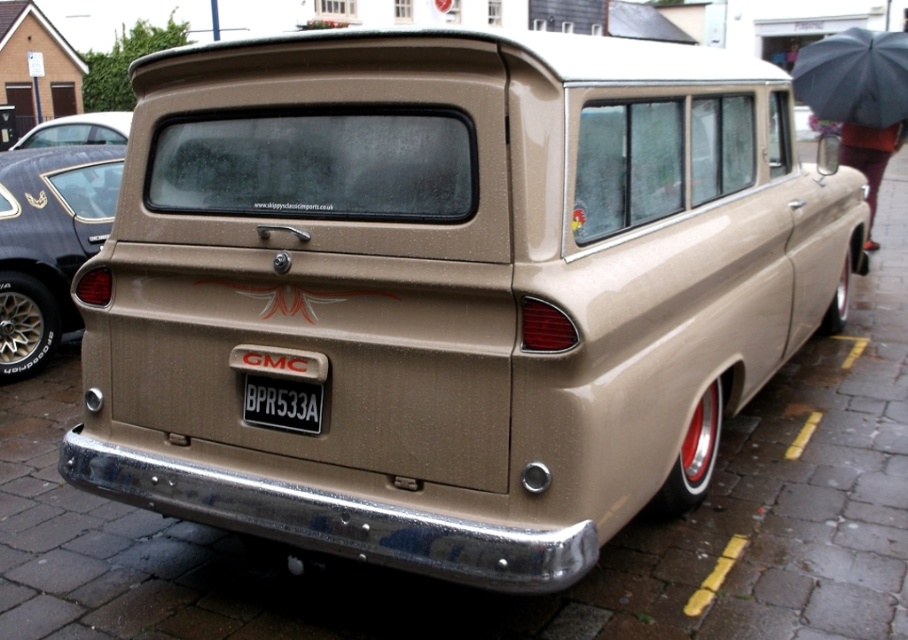
You are a delivery person trying to park your truck between the two vehicles in the image. The truck requires a minimum height clearance of 2 meters. Given that the matte gold van at center is shorter than the matte black car at upper left, which vehicle should you position your truck behind to ensure sufficient clearance?

The matte gold van at center has a lesser height compared to the matte black car at upper left. Therefore, positioning the truck behind the matte gold van at center would provide the required 2 meters of height clearance since it is shorter than the matte black car at upper left.

You are standing on the wet cobblestone street and see the matte gold van at center and the matte black car at upper left. Which vehicle is positioned lower in the scene?

The matte gold van at center is positioned lower than the matte black car at upper left.

You are a delivery person who needs to place the black matte umbrella at upper right and the black plastic license plate at center into a storage box. The box can only hold items narrower than 30 cm. Based on the scene, can both items fit in the box?

The black matte umbrella at upper right might be wider than black plastic license plate at center. Since the box can only hold items narrower than 30 cm, it is uncertain if the umbrella will fit, but the license plate should fit as it is narrower. Check the umbrella width before placing both in the box.